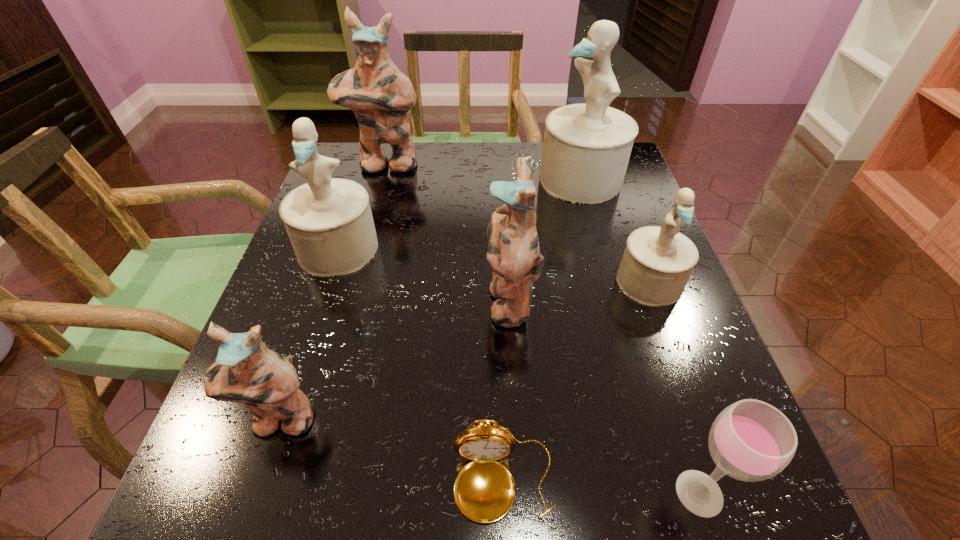
Locate an element on the screen. The height and width of the screenshot is (540, 960). vacant area that lies between the farthest pink figurine and the biggest white figurine is located at coordinates (483, 172).

This screenshot has width=960, height=540. Identify the location of vacant area that lies between the second smallest white figurine and the second smallest pink figurine. (423, 274).

Where is `free space between the third figurine from right to left and the pocket watch`? free space between the third figurine from right to left and the pocket watch is located at coordinates (507, 391).

You are a GUI agent. You are given a task and a screenshot of the screen. Output one action in this format:
    pyautogui.click(x=<x>, y=<y>)
    Task: Click on the object that is the third nearest to the biggest white figurine
    This screenshot has width=960, height=540.
    Given the screenshot: What is the action you would take?
    pyautogui.click(x=380, y=95)

Identify the location of object identified as the third closest to the smallest white figurine. (750, 440).

The width and height of the screenshot is (960, 540). In order to click on figurine that stands as the second closest to the second nearest pink figurine in this screenshot , I will do `click(586, 149)`.

Find the location of a particular element. figurine object that ranks as the third closest to the smallest white figurine is located at coordinates pyautogui.click(x=329, y=222).

The height and width of the screenshot is (540, 960). In order to click on white figurine that stands as the second closest to the biggest pink figurine in this screenshot , I will do `click(586, 149)`.

Where is `the closest white figurine to the smallest white figurine`? The image size is (960, 540). the closest white figurine to the smallest white figurine is located at coordinates (586, 149).

Where is `the second closest pink figurine to the farthest pink figurine`? Image resolution: width=960 pixels, height=540 pixels. the second closest pink figurine to the farthest pink figurine is located at coordinates (246, 371).